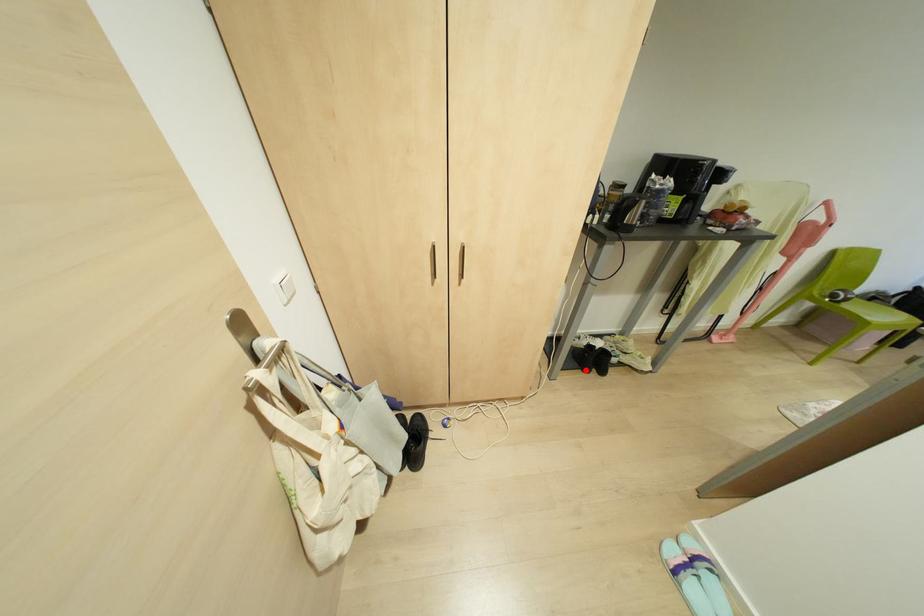
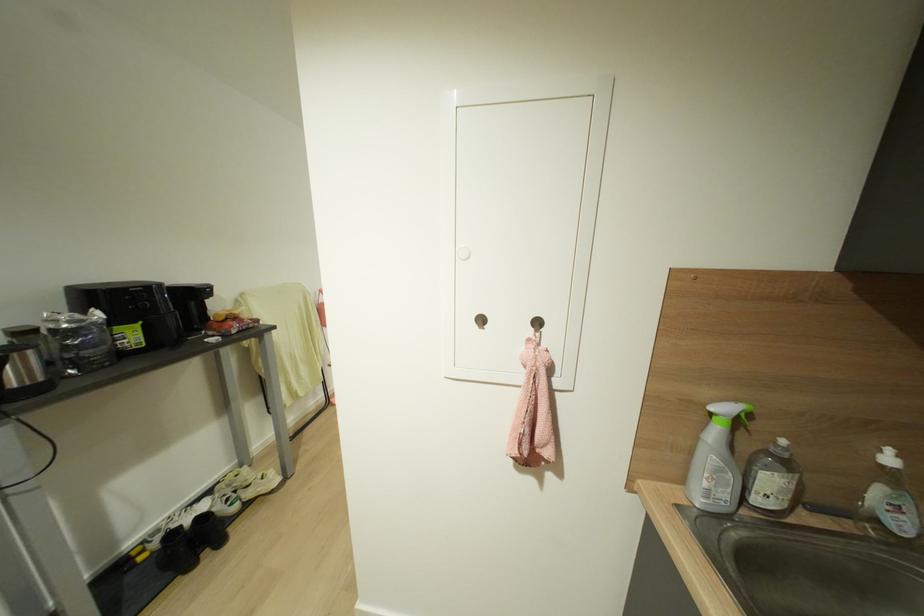
Question: A red point is marked in image1. In image2, is the corresponding 3D point closer to the camera or farther? Reply with the corresponding letter.

Choices:
 (A) The corresponding 3D point is closer.
 (B) The corresponding 3D point is farther.

Answer: (A)